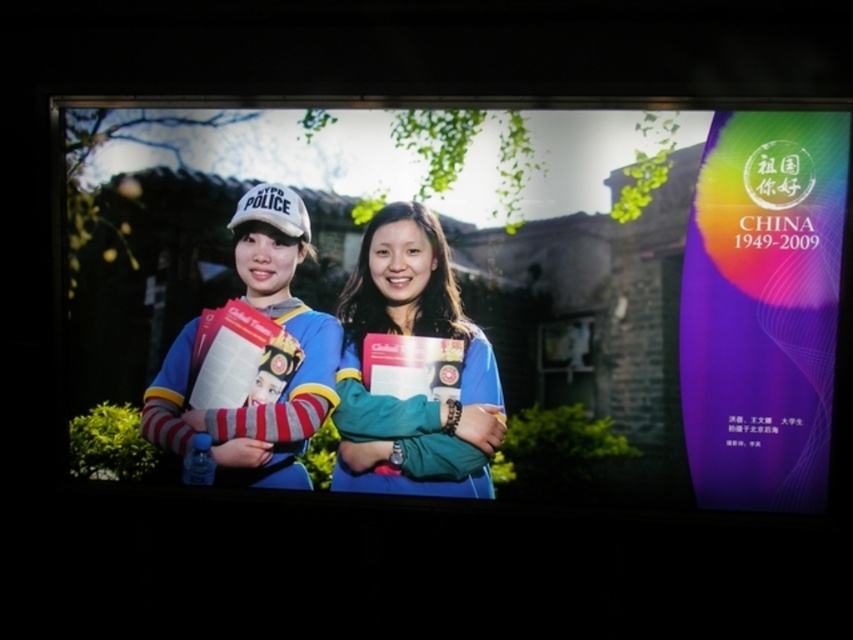
Question: Is blue fabric jacket at center bigger than matte blue jacket at center?

Choices:
 (A) yes
 (B) no

Answer: (B)

Question: Which point is farther from the camera taking this photo?

Choices:
 (A) (479, 483)
 (B) (390, 390)

Answer: (A)

Question: Does blue fabric jacket at center have a larger size compared to matte blue jacket at center?

Choices:
 (A) yes
 (B) no

Answer: (B)

Question: Is blue fabric jacket at center bigger than matte blue jacket at center?

Choices:
 (A) no
 (B) yes

Answer: (A)